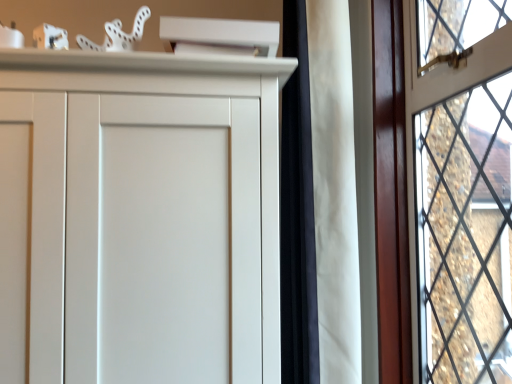
Question: Considering the positions of matte wooden window at right and white matte curtain at center in the image, is matte wooden window at right bigger or smaller than white matte curtain at center?

Choices:
 (A) big
 (B) small

Answer: (B)

Question: Considering their positions, is matte wooden window at right located in front of or behind white matte curtain at center?

Choices:
 (A) behind
 (B) front

Answer: (B)

Question: Does point (457, 64) appear closer or farther from the camera than point (349, 140)?

Choices:
 (A) closer
 (B) farther

Answer: (A)

Question: Is white matte curtain at center bigger or smaller than matte wooden window at right?

Choices:
 (A) small
 (B) big

Answer: (B)

Question: In the image, is white matte curtain at center positioned in front of or behind matte wooden window at right?

Choices:
 (A) behind
 (B) front

Answer: (A)

Question: In terms of height, does white matte curtain at center look taller or shorter compared to matte wooden window at right?

Choices:
 (A) tall
 (B) short

Answer: (A)

Question: Considering the positions of white matte curtain at center and matte wooden window at right in the image, is white matte curtain at center wider or thinner than matte wooden window at right?

Choices:
 (A) wide
 (B) thin

Answer: (B)